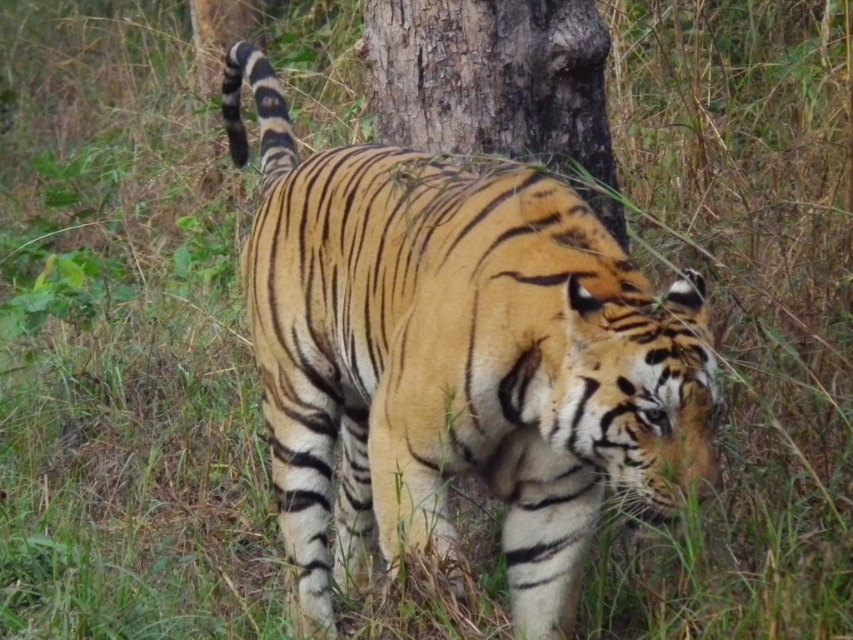
You are a wildlife photographer trying to capture the tiger in the scene. You notice two points marked in the image. One is at point (434, 452) and the other at point (605, 198). Which point is closer to the tiger?

Point (434, 452) is in front of point (605, 198), so it is closer to the tiger.